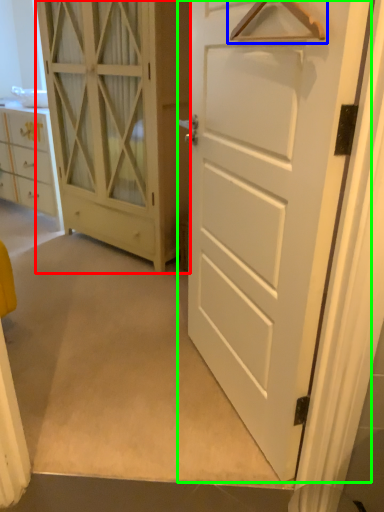
Question: Which object is positioned closest to door (highlighted by a red box)? Select from hanger (highlighted by a blue box) and door (highlighted by a green box).

Choices:
 (A) hanger
 (B) door

Answer: (B)